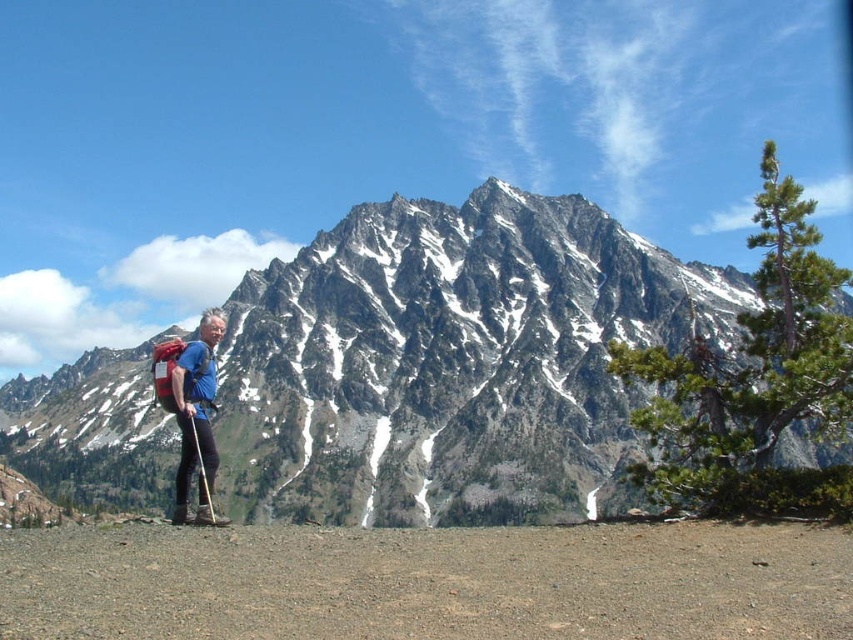
Does green needle-like tree at upper right lie in front of blue fabric backpack at lower left?

Result: That is True.

The height and width of the screenshot is (640, 853). Describe the element at coordinates (753, 380) in the screenshot. I see `green needle-like tree at upper right` at that location.

Identify the location of green needle-like tree at upper right. (753, 380).

Identify the location of green needle-like tree at upper right. (753, 380).

Between point (525, 221) and point (212, 481), which one is positioned behind?

The point (525, 221) is behind.

Does gray rocky mountain at center have a lesser height compared to wooden ski pole at center?

Incorrect, gray rocky mountain at center's height does not fall short of wooden ski pole at center's.

Describe the element at coordinates (451, 362) in the screenshot. The width and height of the screenshot is (853, 640). I see `gray rocky mountain at center` at that location.

I want to click on gray rocky mountain at center, so click(451, 362).

Does green needle-like tree at upper right appear on the right side of wooden ski pole at center?

Correct, you'll find green needle-like tree at upper right to the right of wooden ski pole at center.

Is point (772, 268) closer to camera compared to point (196, 442)?

No, it is not.

Find the location of `green needle-like tree at upper right`. green needle-like tree at upper right is located at coordinates (753, 380).